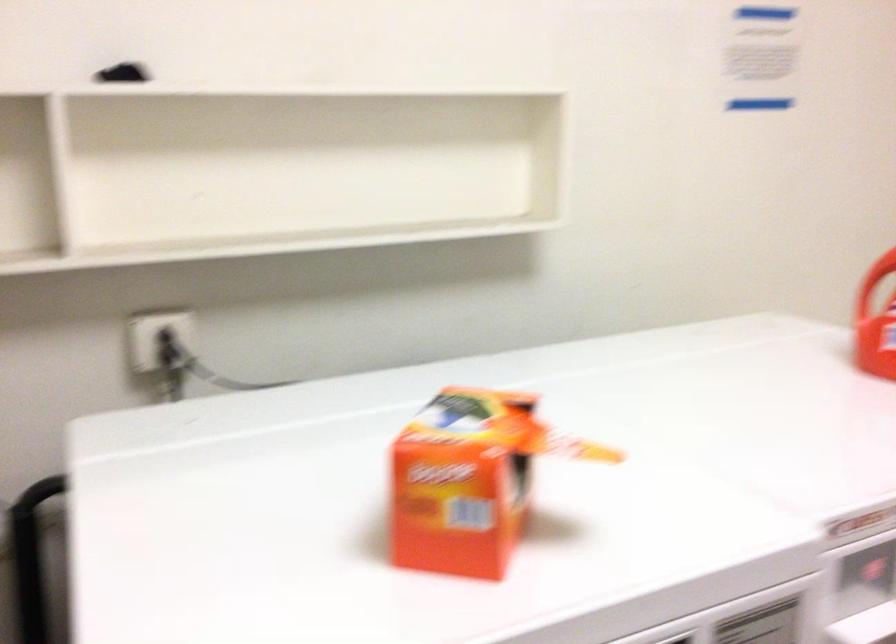
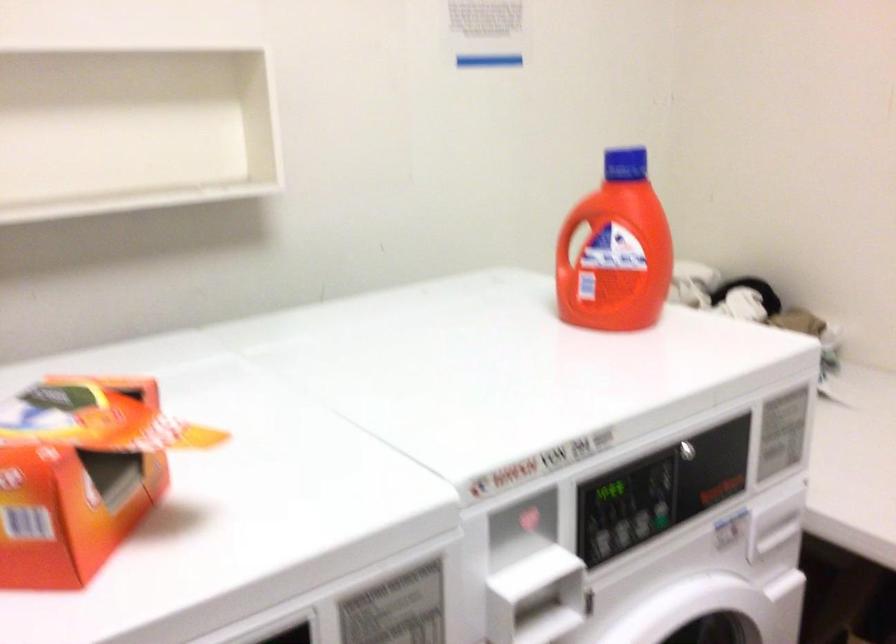
Question: The images are taken continuously from a first-person perspective. In which direction are you moving?

Choices:
 (A) Left
 (B) Right
 (C) Forward
 (D) Backward

Answer: (B)